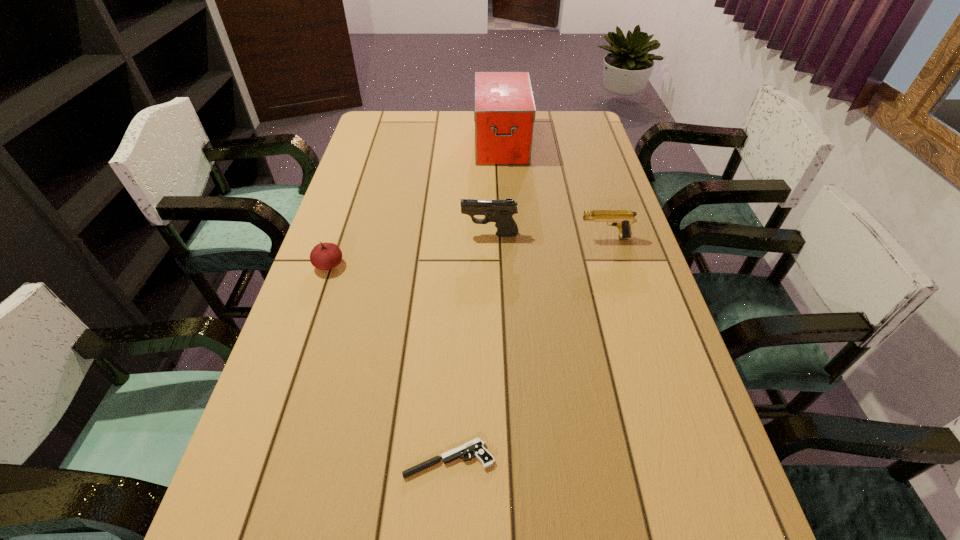
The height and width of the screenshot is (540, 960). I want to click on vacant area that lies between the second tallest object and the first-aid kit, so click(x=495, y=189).

Image resolution: width=960 pixels, height=540 pixels. Identify the location of vacant area that lies between the fourth tallest object and the shortest object. tap(389, 362).

The height and width of the screenshot is (540, 960). What are the coordinates of `free space between the nearest pistol and the second tallest object` in the screenshot? It's located at (469, 347).

The height and width of the screenshot is (540, 960). I want to click on free point between the second tallest object and the tallest object, so click(495, 189).

The width and height of the screenshot is (960, 540). I want to click on free spot between the fourth shortest object and the shortest pistol, so click(469, 347).

The height and width of the screenshot is (540, 960). I want to click on vacant space in between the tallest object and the third shortest object, so click(x=553, y=191).

The height and width of the screenshot is (540, 960). Find the location of `vacant space that's between the farthest object and the leftmost object`. vacant space that's between the farthest object and the leftmost object is located at coordinates (415, 204).

The image size is (960, 540). I want to click on object that can be found as the fourth closest to the second tallest pistol, so click(324, 256).

Locate which object is the third closest to the shortest object. Please provide its 2D coordinates. Your answer should be formatted as a tuple, i.e. [(x, y)], where the tuple contains the x and y coordinates of a point satisfying the conditions above.

[(622, 219)]

Where is `the closest pistol to the second tallest object`? The height and width of the screenshot is (540, 960). the closest pistol to the second tallest object is located at coordinates (622, 219).